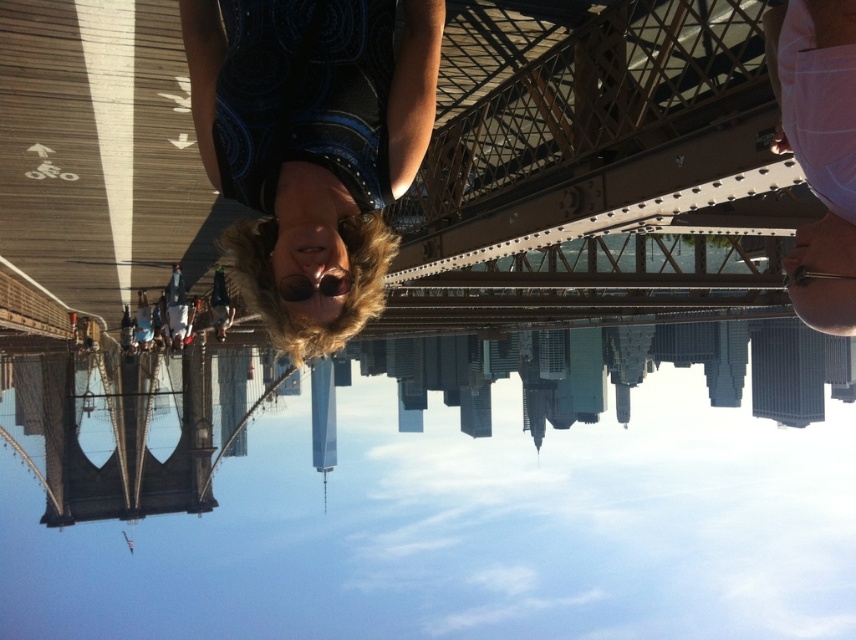
Is transparent glass water at center thinner than metal bridge at center?

No.

Is point (736, 396) closer to camera compared to point (354, 237)?

No, it is behind (354, 237).

You are a GUI agent. You are given a task and a screenshot of the screen. Output one action in this format:
    pyautogui.click(x=<x>, y=<y>)
    Task: Click on the transparent glass water at center
    The height and width of the screenshot is (640, 856).
    Given the screenshot: What is the action you would take?
    pyautogui.click(x=438, y=488)

Identify the location of transparent glass water at center. The height and width of the screenshot is (640, 856). (438, 488).

Which is behind, point (346, 445) or point (207, 124)?

The point (346, 445) is behind.

Is transparent glass water at center bigger than dark blue printed dress at center?

Indeed, transparent glass water at center has a larger size compared to dark blue printed dress at center.

Measure the distance between transparent glass water at center and camera.

The distance of transparent glass water at center from camera is 583.35 feet.

Where is `transparent glass water at center`? Image resolution: width=856 pixels, height=640 pixels. transparent glass water at center is located at coordinates (438, 488).

Is metal bridge at center below dark blue printed dress at center?

Actually, metal bridge at center is above dark blue printed dress at center.

Can you confirm if metal bridge at center is positioned above dark blue printed dress at center?

Yes, metal bridge at center is above dark blue printed dress at center.

Does point (833, 230) lie in front of point (324, 48)?

Yes, point (833, 230) is closer to viewer.

Locate an element on the screen. The image size is (856, 640). metal bridge at center is located at coordinates (x=405, y=145).